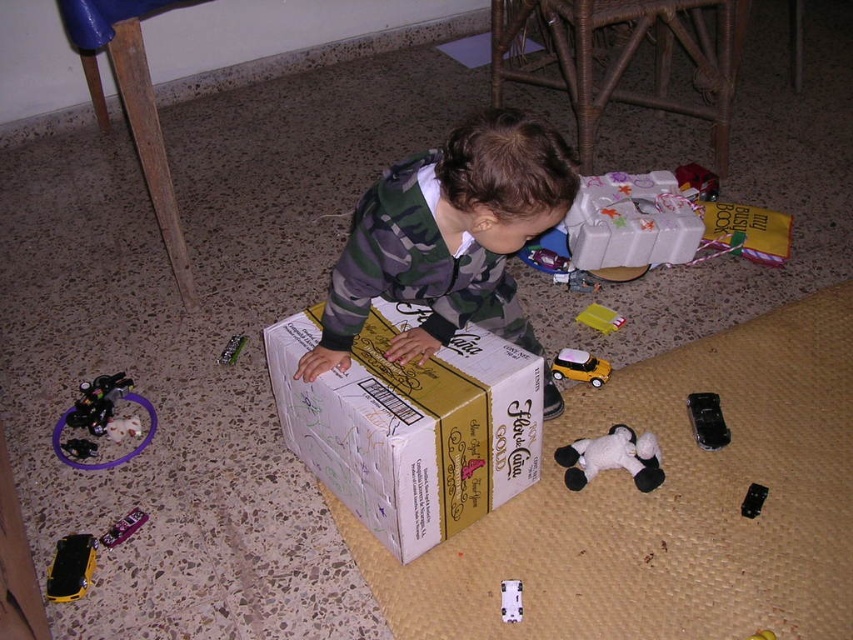
Does yellow plastic toy at center appear on the right side of metallic silver remote control at center?

Yes, yellow plastic toy at center is to the right of metallic silver remote control at center.

Looking at this image, who is more forward, (598, 314) or (233, 336)?

Positioned in front is point (233, 336).

Who is more forward, (582, 323) or (234, 333)?

Point (582, 323)

You are a GUI agent. You are given a task and a screenshot of the screen. Output one action in this format:
    pyautogui.click(x=<x>, y=<y>)
    Task: Click on the yellow plastic toy at center
    The height and width of the screenshot is (640, 853).
    Given the screenshot: What is the action you would take?
    pyautogui.click(x=601, y=317)

Does white cardboard box at center appear over metallic purple toy car at lower left?

Yes.

Who is positioned more to the left, white cardboard box at center or metallic purple toy car at lower left?

From the viewer's perspective, metallic purple toy car at lower left appears more on the left side.

The height and width of the screenshot is (640, 853). What do you see at coordinates (410, 426) in the screenshot?
I see `white cardboard box at center` at bounding box center [410, 426].

This screenshot has height=640, width=853. Find the location of `white cardboard box at center`. white cardboard box at center is located at coordinates (410, 426).

Does yellow matte toy car at center appear over yellow plastic toy at center?

No, yellow matte toy car at center is not above yellow plastic toy at center.

Who is taller, yellow matte toy car at center or yellow plastic toy at center?

Standing taller between the two is yellow matte toy car at center.

Measure the distance between yellow matte toy car at center and camera.

yellow matte toy car at center and camera are 1.76 meters apart from each other.

I want to click on yellow matte toy car at center, so click(x=579, y=365).